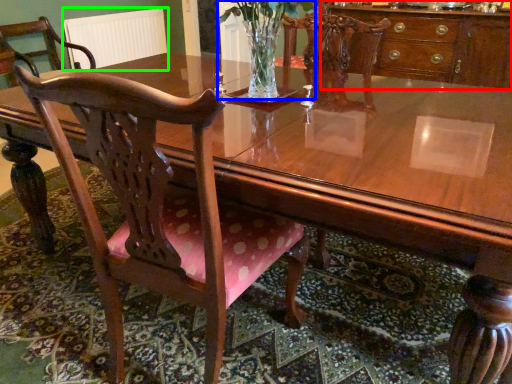
Question: Based on their relative distances, which object is nearer to cabinetry (highlighted by a red box)? Choose from floral arrangement (highlighted by a blue box) and radiator (highlighted by a green box).

Choices:
 (A) floral arrangement
 (B) radiator

Answer: (A)